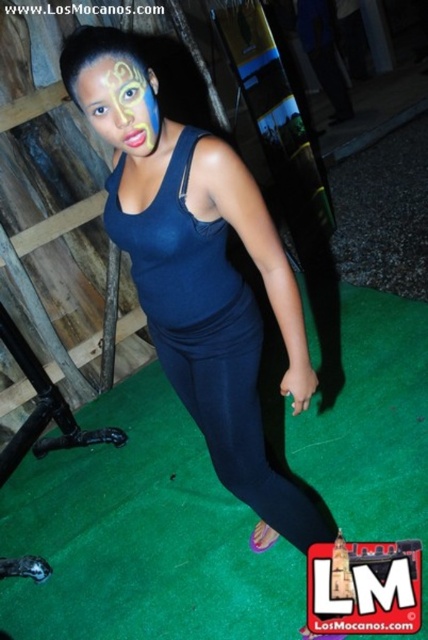
Between satin dark blue pants at center and yellow matte face paint at center, which one appears on the left side from the viewer's perspective?

Positioned to the left is yellow matte face paint at center.

The height and width of the screenshot is (640, 428). What do you see at coordinates (238, 417) in the screenshot?
I see `satin dark blue pants at center` at bounding box center [238, 417].

Where is `satin dark blue pants at center`? satin dark blue pants at center is located at coordinates (238, 417).

Is matte blue tank top at center taller than yellow matte face paint at center?

Yes, matte blue tank top at center is taller than yellow matte face paint at center.

Who is positioned more to the right, matte blue tank top at center or yellow matte face paint at center?

Positioned to the right is matte blue tank top at center.

Which is in front, point (293, 324) or point (149, 97)?

Positioned in front is point (149, 97).

Locate an element on the screen. matte blue tank top at center is located at coordinates (216, 310).

Between matte blue tank top at center and satin dark blue pants at center, which one is positioned higher?

matte blue tank top at center is above.

Who is positioned more to the right, matte blue tank top at center or satin dark blue pants at center?

satin dark blue pants at center

Is point (148, 282) behind point (244, 436)?

No, it is in front of (244, 436).

Identify the location of matte blue tank top at center. The width and height of the screenshot is (428, 640). (216, 310).